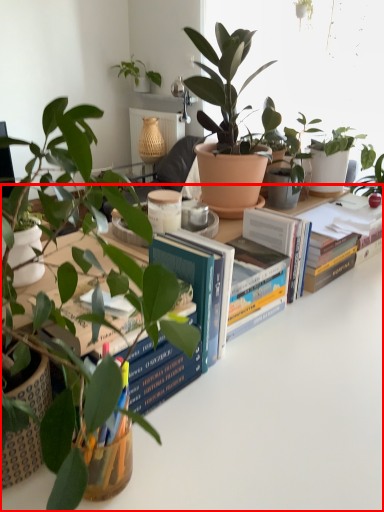
Question: From the image's perspective, considering the relative positions of table (annotated by the red box) and paperback book in the image provided, where is table (annotated by the red box) located with respect to the staircase?

Choices:
 (A) above
 (B) below

Answer: (B)